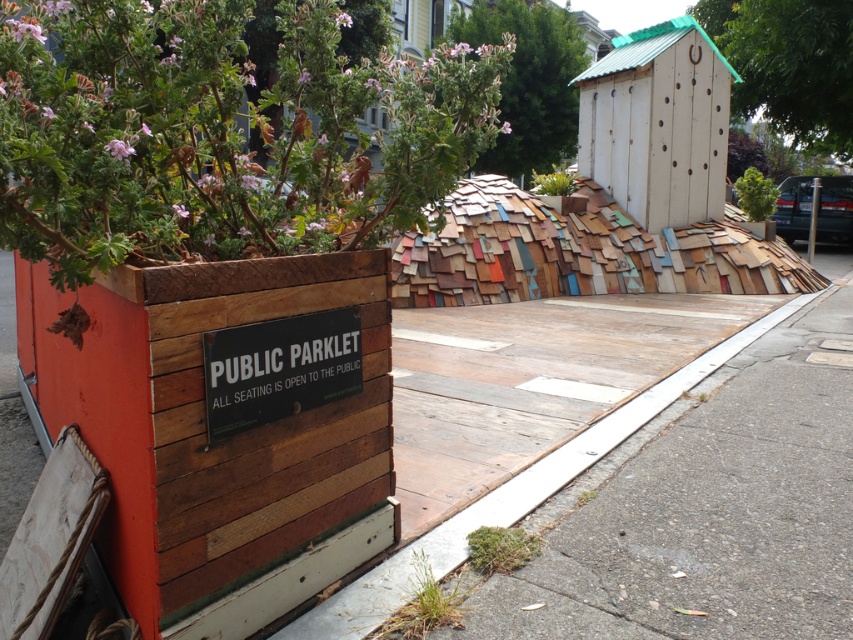
Can you confirm if pink matte flower at upper left is bigger than pink petal at upper center?

Actually, pink matte flower at upper left might be smaller than pink petal at upper center.

What are the coordinates of `pink matte flower at upper left` in the screenshot? It's located at (119, 148).

Does point (61, 412) lie in front of point (444, 595)?

No, it is not.

Does wooden planter at left appear under green grass at lower center?

Actually, wooden planter at left is above green grass at lower center.

Which is behind, point (91, 346) or point (421, 621)?

Point (421, 621)

Find the location of `wooden planter at left`. wooden planter at left is located at coordinates (219, 426).

Is the position of green grass at lower center less distant than that of pink matte flower at upper left?

No, green grass at lower center is further to the viewer.

Is point (456, 624) positioned in front of point (120, 141)?

No, (456, 624) is behind (120, 141).

The height and width of the screenshot is (640, 853). What are the coordinates of `green grass at lower center` in the screenshot? It's located at (422, 605).